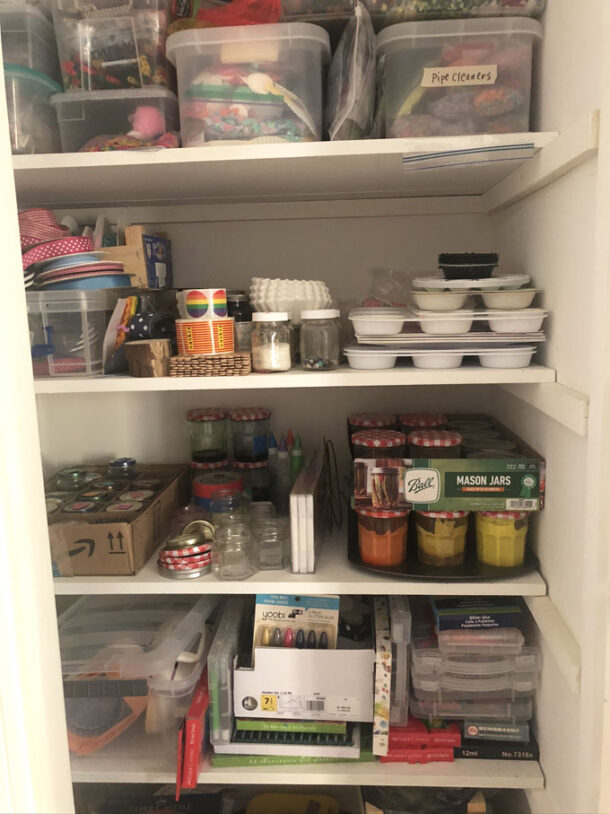
You are a GUI agent. You are given a task and a screenshot of the screen. Output one action in this format:
    pyautogui.click(x=<x>, y=<y>)
    Task: Click on the shelves
    This screenshot has height=814, width=610.
    Given the screenshot: What is the action you would take?
    pyautogui.click(x=342, y=776), pyautogui.click(x=263, y=588), pyautogui.click(x=284, y=383), pyautogui.click(x=265, y=155)